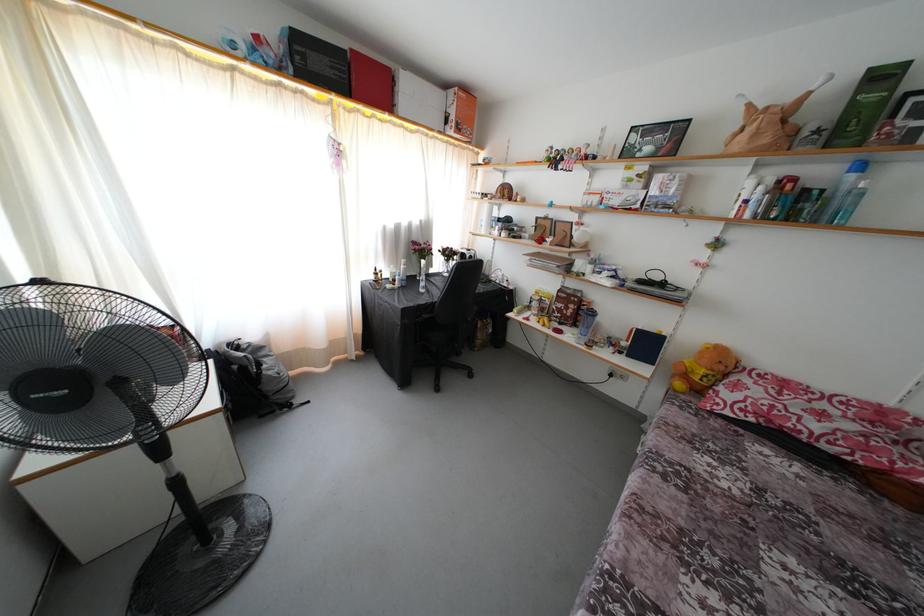
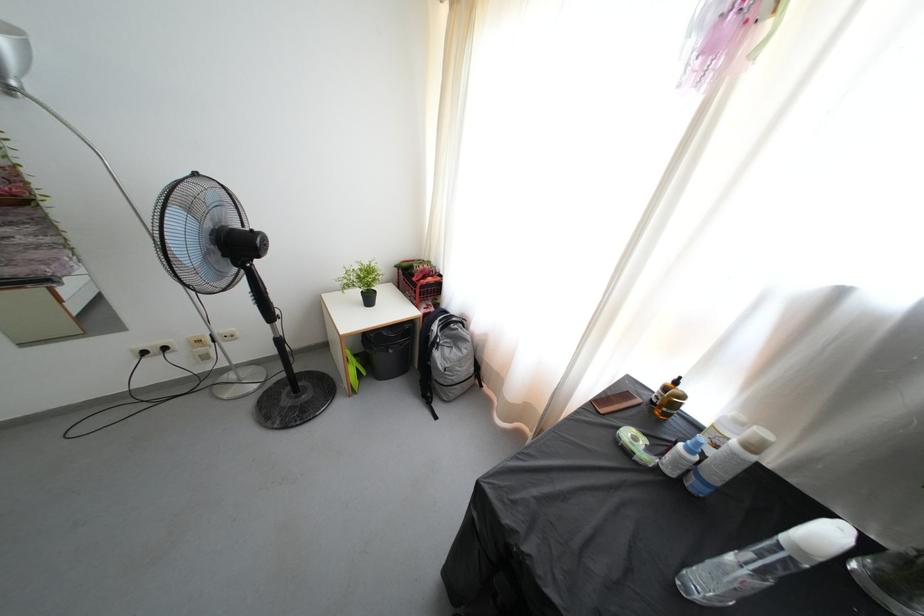
Find the pixel in the second image that matches [397,294] in the first image.

(631, 458)